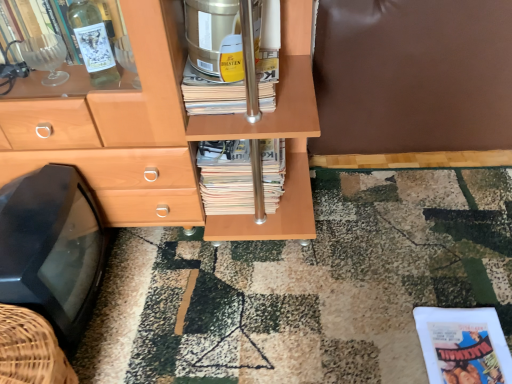
Question: Is gold metallic canister at center positioned in front of stacked paper magazine at center?

Choices:
 (A) no
 (B) yes

Answer: (B)

Question: Is gold metallic canister at center facing away from stacked paper magazine at center?

Choices:
 (A) yes
 (B) no

Answer: (B)

Question: Does gold metallic canister at center have a lesser width compared to stacked paper magazine at center?

Choices:
 (A) no
 (B) yes

Answer: (A)

Question: From the image's perspective, is gold metallic canister at center under stacked paper magazine at center?

Choices:
 (A) no
 (B) yes

Answer: (A)

Question: Would you say gold metallic canister at center is outside stacked paper magazine at center?

Choices:
 (A) no
 (B) yes

Answer: (B)

Question: Is gold metallic canister at center shorter than stacked paper magazine at center?

Choices:
 (A) yes
 (B) no

Answer: (A)

Question: From the image's perspective, is matte white paperback book at lower right below black plastic tv at lower left?

Choices:
 (A) yes
 (B) no

Answer: (A)

Question: Are matte white paperback book at lower right and black plastic tv at lower left located far from each other?

Choices:
 (A) no
 (B) yes

Answer: (A)

Question: From the image's perspective, would you say matte white paperback book at lower right is positioned over black plastic tv at lower left?

Choices:
 (A) no
 (B) yes

Answer: (A)

Question: Is matte white paperback book at lower right positioned with its back to black plastic tv at lower left?

Choices:
 (A) no
 (B) yes

Answer: (A)

Question: Is black plastic tv at lower left a part of matte white paperback book at lower right?

Choices:
 (A) no
 (B) yes

Answer: (A)

Question: Does matte white paperback book at lower right have a larger size compared to black plastic tv at lower left?

Choices:
 (A) no
 (B) yes

Answer: (A)

Question: From a real-world perspective, is matte white paperback book at lower right on top of stacked paper magazine at center?

Choices:
 (A) yes
 (B) no

Answer: (B)